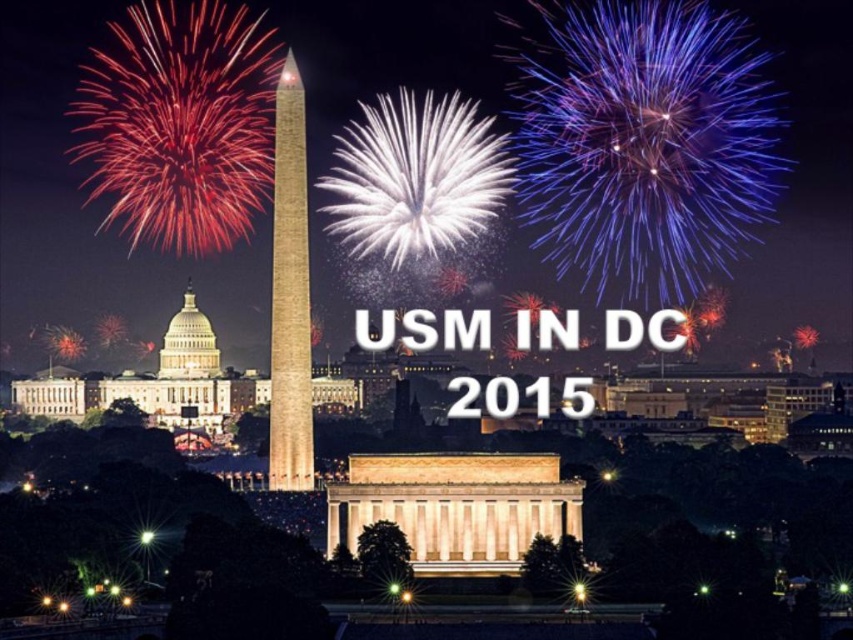
Is smooth stone monument at center below white marble dome at center?

No, smooth stone monument at center is not below white marble dome at center.

Who is positioned more to the left, smooth stone monument at center or white marble dome at center?

Positioned to the left is white marble dome at center.

Which is behind, point (309, 346) or point (190, 346)?

Point (190, 346)

You are a GUI agent. You are given a task and a screenshot of the screen. Output one action in this format:
    pyautogui.click(x=<x>, y=<y>)
    Task: Click on the smooth stone monument at center
    
    Given the screenshot: What is the action you would take?
    pyautogui.click(x=289, y=292)